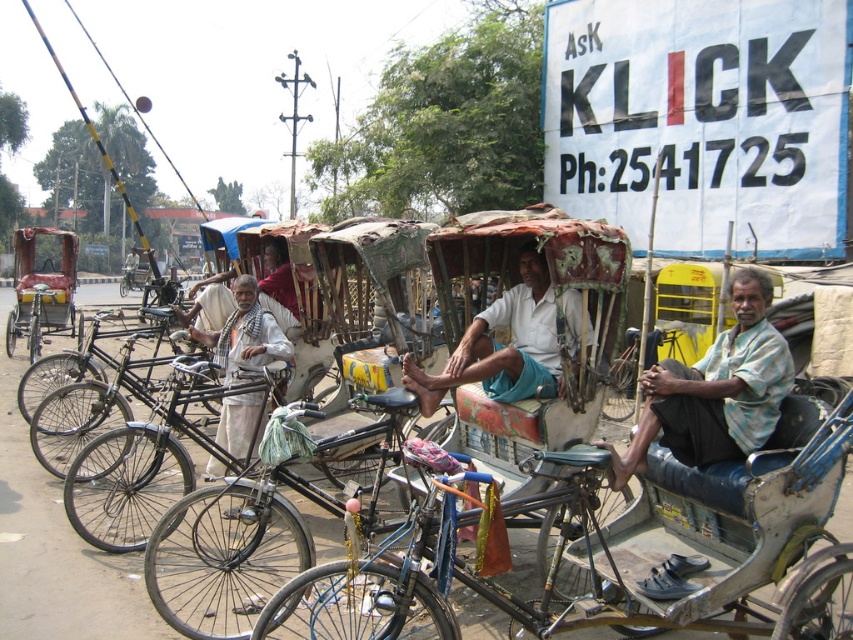
Question: Is blue metallic bicycle at center bigger than rusty metal rickshaw at left?

Choices:
 (A) yes
 (B) no

Answer: (B)

Question: Is blue metallic bicycle at center closer to camera compared to light blue shirt at center?

Choices:
 (A) yes
 (B) no

Answer: (A)

Question: Which object is positioned closest to the blue metallic bicycle at center?

Choices:
 (A) white cotton shirt at center
 (B) shiny metallic bicycle at center
 (C) light blue shirt at center
 (D) rusty metal rickshaw at left

Answer: (C)

Question: Does light blue shirt at center lie in front of white cotton scarf at center?

Choices:
 (A) yes
 (B) no

Answer: (A)

Question: Estimate the real-world distances between objects in this image. Which object is farther from the blue metallic bicycle at center?

Choices:
 (A) light blue shirt at center
 (B) black matte bicycle at center
 (C) white cotton scarf at center

Answer: (C)

Question: Which point is farther to the camera?

Choices:
 (A) black matte bicycle at center
 (B) rusty metal rickshaw at left
 (C) white cotton shirt at center

Answer: (B)